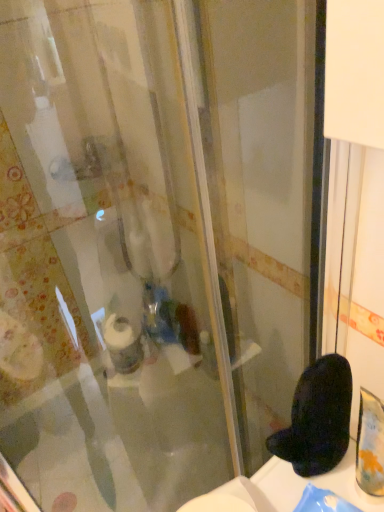
Question: Looking at their shapes, would you say white matte toilet paper at center is wider or thinner than black fuzzy slipper at lower right?

Choices:
 (A) thin
 (B) wide

Answer: (A)

Question: From a real-world perspective, is white matte toilet paper at center physically located above or below black fuzzy slipper at lower right?

Choices:
 (A) above
 (B) below

Answer: (B)

Question: Is white matte toilet paper at center taller or shorter than black fuzzy slipper at lower right?

Choices:
 (A) short
 (B) tall

Answer: (B)

Question: Looking at their shapes, would you say black fuzzy slipper at lower right is wider or thinner than white matte toilet paper at center?

Choices:
 (A) thin
 (B) wide

Answer: (B)

Question: Is black fuzzy slipper at lower right inside the boundaries of white matte toilet paper at center, or outside?

Choices:
 (A) outside
 (B) inside

Answer: (A)

Question: In the image, is black fuzzy slipper at lower right on the left side or the right side of white matte toilet paper at center?

Choices:
 (A) right
 (B) left

Answer: (A)

Question: Considering the positions of black fuzzy slipper at lower right and white matte toilet paper at center in the image, is black fuzzy slipper at lower right bigger or smaller than white matte toilet paper at center?

Choices:
 (A) big
 (B) small

Answer: (B)